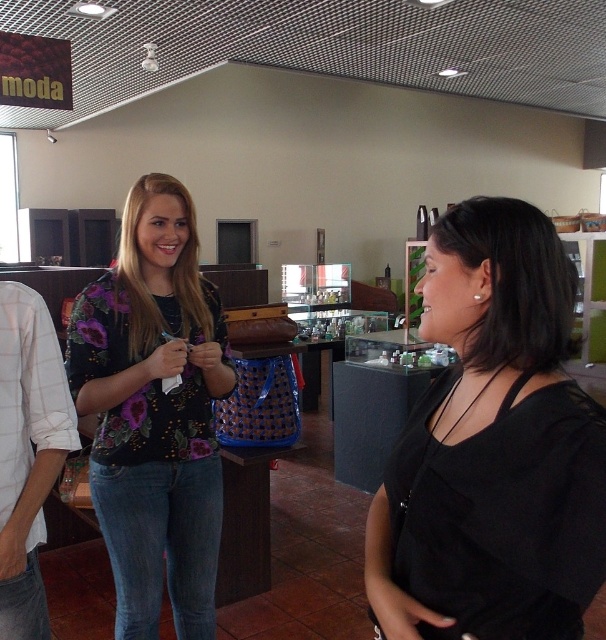
Can you confirm if black matte shirt at center is positioned to the right of floral-patterned shirt at center?

Indeed, black matte shirt at center is positioned on the right side of floral-patterned shirt at center.

Describe the element at coordinates (493, 448) in the screenshot. I see `black matte shirt at center` at that location.

Where is `black matte shirt at center`? black matte shirt at center is located at coordinates (493, 448).